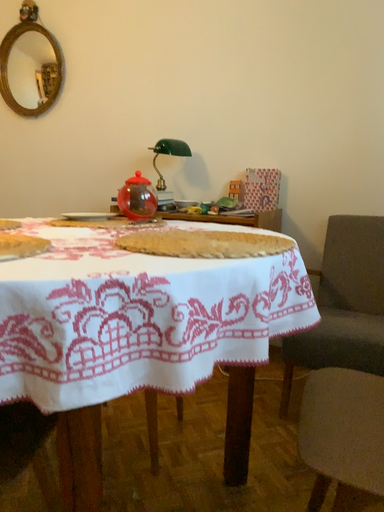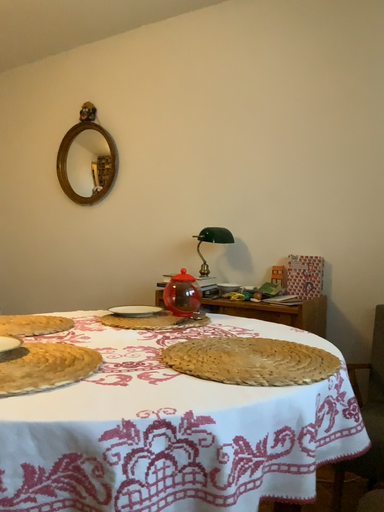
Question: How did the camera likely rotate when shooting the video?

Choices:
 (A) rotated upward
 (B) rotated downward

Answer: (A)